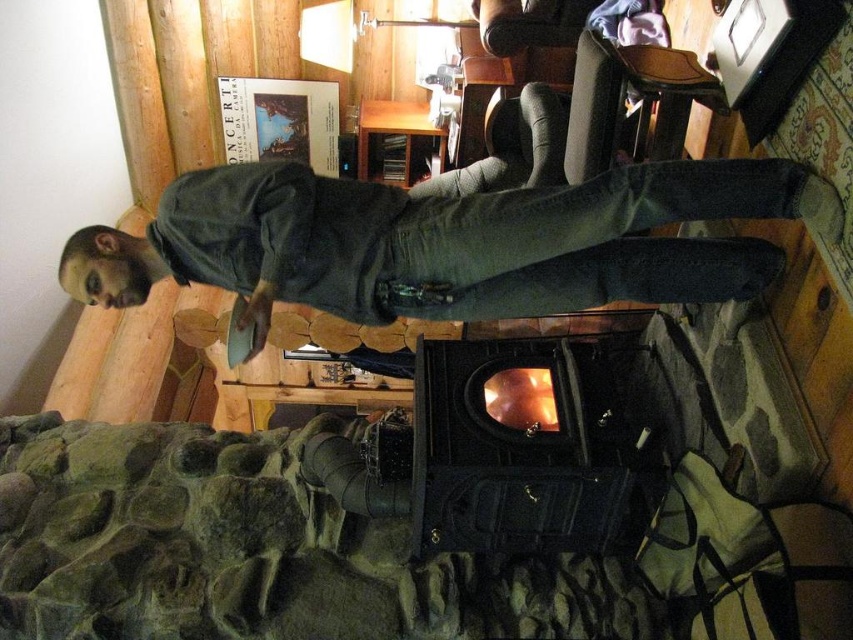
Question: Which point appears farthest from the camera in this image?

Choices:
 (A) (695, 300)
 (B) (566, 404)

Answer: (A)

Question: Is dark green shirt at center above black cast iron fireplace at center?

Choices:
 (A) yes
 (B) no

Answer: (A)

Question: Can you confirm if dark green shirt at center is positioned above black cast iron fireplace at center?

Choices:
 (A) no
 (B) yes

Answer: (B)

Question: Can you confirm if dark green shirt at center is positioned to the right of black cast iron fireplace at center?

Choices:
 (A) yes
 (B) no

Answer: (B)